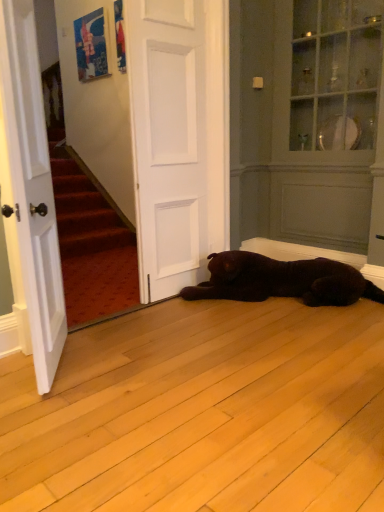
Question: Which direction should I rotate to face white matte door at center, which is counted as the second door, starting from the front, — up or down?

Choices:
 (A) up
 (B) down

Answer: (A)

Question: Does white matte door at center, marked as the 2th door in a left-to-right arrangement, appear on the right side of matte white armoire at upper right?

Choices:
 (A) yes
 (B) no

Answer: (B)

Question: From a real-world perspective, is white matte door at center, which is the 1th door from back to front, positioned under matte white armoire at upper right based on gravity?

Choices:
 (A) no
 (B) yes

Answer: (B)

Question: Is matte white armoire at upper right surrounded by white matte door at center, which is the 1th door from back to front?

Choices:
 (A) no
 (B) yes

Answer: (A)

Question: Is white matte door at center, marked as the 2th door in a left-to-right arrangement, taller than matte white armoire at upper right?

Choices:
 (A) no
 (B) yes

Answer: (A)

Question: Is white matte door at center, positioned as the 1th door in right-to-left order, facing away from matte white armoire at upper right?

Choices:
 (A) no
 (B) yes

Answer: (A)

Question: Is white matte door at center, which is counted as the second door, starting from the front, thinner than matte white armoire at upper right?

Choices:
 (A) no
 (B) yes

Answer: (B)

Question: Is white wood door at left, the 2th door from the right, at the back of matte white armoire at upper right?

Choices:
 (A) no
 (B) yes

Answer: (A)

Question: Is matte white armoire at upper right far away from white wood door at left, which appears as the 2th door when viewed from the back?

Choices:
 (A) no
 (B) yes

Answer: (B)

Question: Considering the relative sizes of matte white armoire at upper right and white wood door at left, which appears as the 2th door when viewed from the back, in the image provided, is matte white armoire at upper right bigger than white wood door at left, which appears as the 2th door when viewed from the back,?

Choices:
 (A) no
 (B) yes

Answer: (B)

Question: Does matte white armoire at upper right turn towards white wood door at left, which appears as the first door when viewed from the left?

Choices:
 (A) yes
 (B) no

Answer: (A)

Question: From a real-world perspective, is matte white armoire at upper right positioned under white wood door at left, the 2th door from the right, based on gravity?

Choices:
 (A) yes
 (B) no

Answer: (B)

Question: From the image's perspective, is matte white armoire at upper right located above white wood door at left, which appears as the 2th door when viewed from the back?

Choices:
 (A) yes
 (B) no

Answer: (A)

Question: Is white matte door at center, marked as the 2th door in a left-to-right arrangement, not close to white wood door at left, the first door from the front?

Choices:
 (A) yes
 (B) no

Answer: (B)